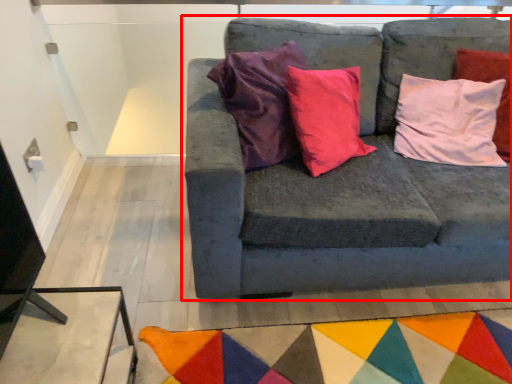
Question: Observing the image, what is the correct spatial positioning of studio couch (annotated by the red box) in reference to mat?

Choices:
 (A) right
 (B) left

Answer: (A)